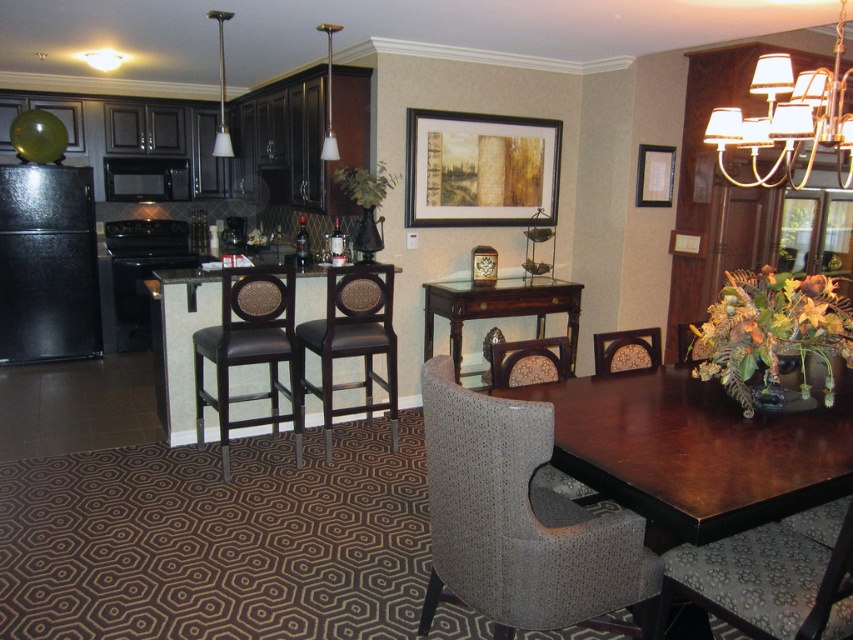
You are standing at the entrance of the kitchen and want to sit down in the patterned fabric swivel chair at lower right. According to the coordinates provided, is the chair located closer to the right side or the left side of the room?

The patterned fabric swivel chair at lower right is located at coordinates point (767,580). Since the x coordinate is 0.908, which is closer to 1, the chair is positioned closer to the right side of the room.

You are standing in the kitchen and dining area and want to move from the dining table to the kitchen counter. The dining table is near point (770, 532) and the kitchen counter is near point (184, 195). Which point should you head towards first if you want to reach the kitchen counter quickly?

You should head towards point (184, 195) first because it is the location of the kitchen counter. Since point (770, 532) is closer to the camera, it might be in front of you, but the kitchen counter is at point (184, 195) which is further away. Wait, but the question says to reach the kitchen counter quickly. Hmm, maybe I need to recheck the description. The Objects Description says point (770, 532) is closer to the camera than point (184, 195). So if you are at the dining table near point 0.833,